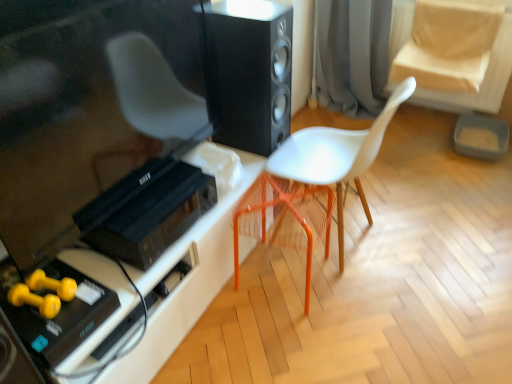
At what (x,y) coordinates should I click in order to perform the action: click on vacant space in gray fabric curtain at upper center (from a real-world perspective). Please return your answer as a coordinate pair (x, y). The image size is (512, 384). Looking at the image, I should click on (340, 117).